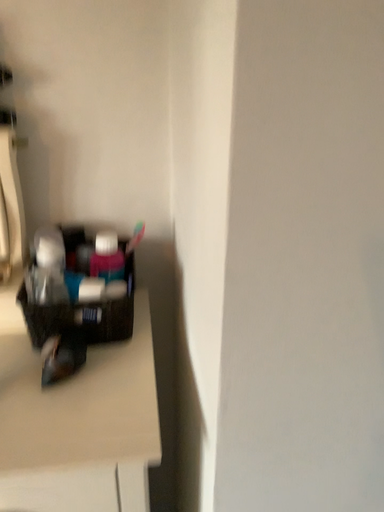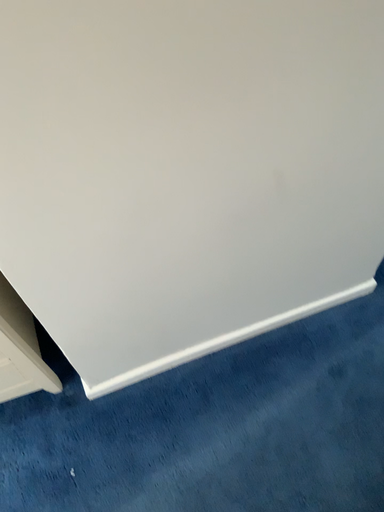
Question: How did the camera likely rotate when shooting the video?

Choices:
 (A) rotated left
 (B) rotated right

Answer: (B)